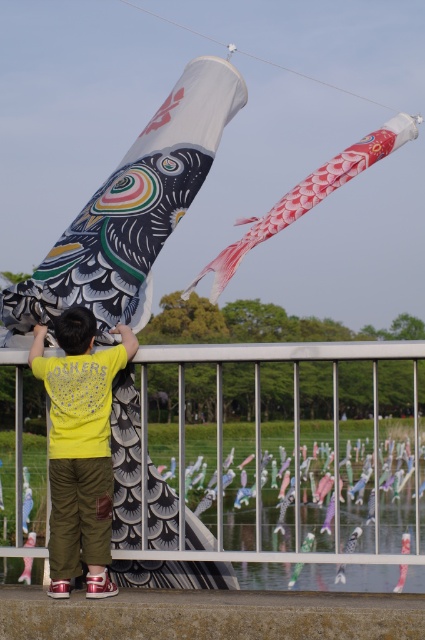
You are a photographer trying to capture a photo of the red textured fabric kite at upper center without the metallic silver fence at lower center appearing in the frame. Based on their positions, is this possible?

The metallic silver fence at lower center is located below the red textured fabric kite at upper center, so it is possible to frame the photo such that the red textured fabric kite at upper center is visible while excluding the metallic silver fence at lower center by adjusting the camera angle upwards.

Consider the image. You are a photographer trying to capture a photo of the red textured fabric kite at upper center without the metallic silver fence at lower center appearing in the frame. Based on their positions, can you adjust your camera angle to achieve this?

The metallic silver fence at lower center is positioned on the left side of the red textured fabric kite at upper center. By moving to the right side of the fence or angling the camera to the right, you can avoid including the fence in the photo frame while focusing on the kite.